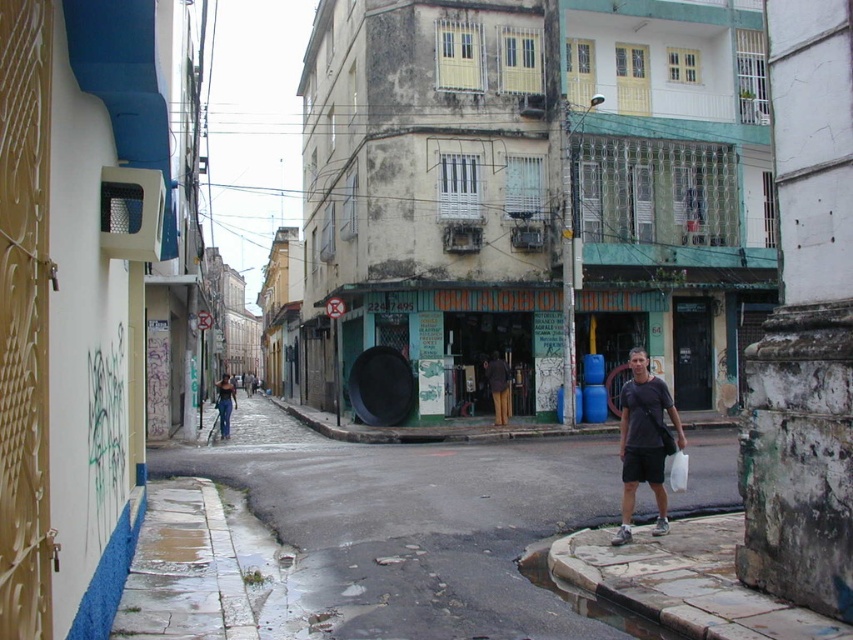
Who is positioned more to the right, dark gray t-shirt at center or matte black jacket at center?

dark gray t-shirt at center is more to the right.

The height and width of the screenshot is (640, 853). In order to click on dark gray t-shirt at center in this screenshot , I will do (x=643, y=442).